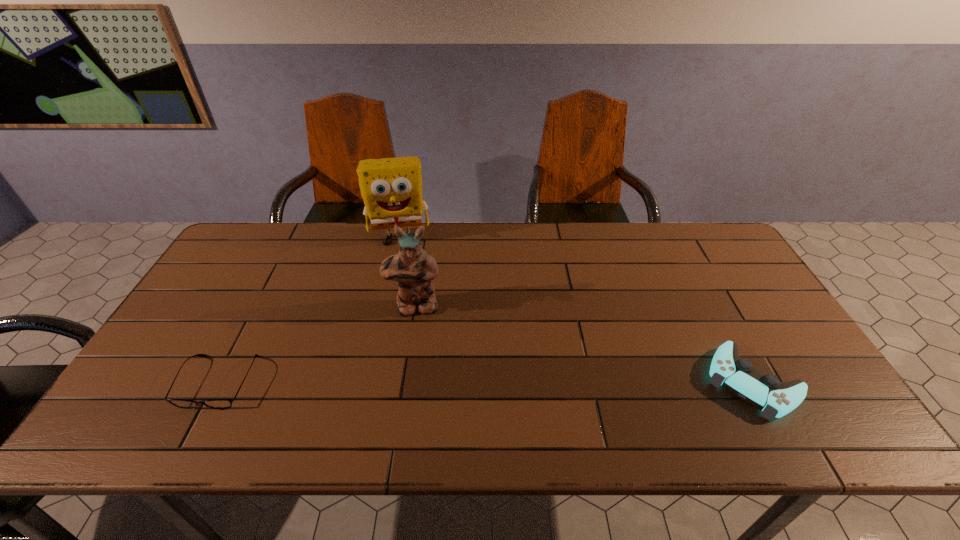
This screenshot has height=540, width=960. I want to click on vacant space at the far edge, so click(327, 232).

Where is `vacant space at the near edge`? This screenshot has width=960, height=540. vacant space at the near edge is located at coordinates (552, 379).

This screenshot has width=960, height=540. Identify the location of vacant area at the right edge of the desktop. (744, 287).

Image resolution: width=960 pixels, height=540 pixels. In the image, there is a desktop. In order to click on vacant space at the far right corner in this screenshot , I will do `click(712, 240)`.

This screenshot has width=960, height=540. Identify the location of vacant area that lies between the farthest object and the third tallest object. (576, 309).

Find the location of `vacant area between the sponge and the spectacles`. vacant area between the sponge and the spectacles is located at coordinates tap(309, 309).

Image resolution: width=960 pixels, height=540 pixels. Identify the location of unoccupied area between the third tallest object and the spectacles. (486, 382).

The image size is (960, 540). Identify the location of vacant area that lies between the control and the shortest object. (486, 382).

You are a GUI agent. You are given a task and a screenshot of the screen. Output one action in this format:
    pyautogui.click(x=<x>, y=<y>)
    Task: Click on the unoccupied area between the spectacles and the farthest object
    The height and width of the screenshot is (540, 960).
    Given the screenshot: What is the action you would take?
    pyautogui.click(x=309, y=309)

Identify the location of empty space between the sponge and the control. This screenshot has height=540, width=960. (576, 309).